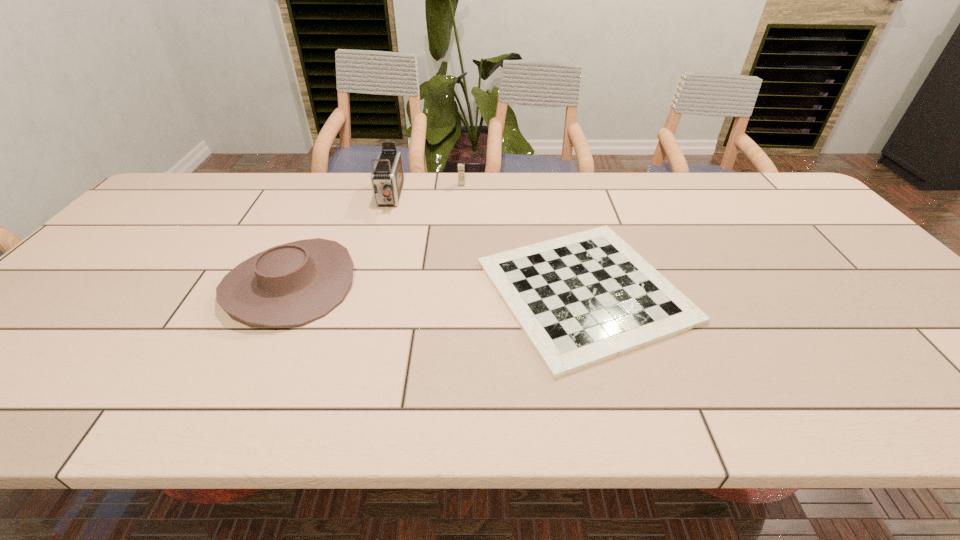
Locate an element on the screen. The image size is (960, 540). the tallest object is located at coordinates (x=387, y=177).

Where is `the second tallest object`? This screenshot has height=540, width=960. the second tallest object is located at coordinates (461, 172).

Find the location of a particular element. The height and width of the screenshot is (540, 960). the second object from right to left is located at coordinates click(461, 172).

Locate an element on the screen. The height and width of the screenshot is (540, 960). cowboy hat is located at coordinates (293, 284).

The width and height of the screenshot is (960, 540). What are the coordinates of `the shortest object` in the screenshot? It's located at (580, 299).

You are a GUI agent. You are given a task and a screenshot of the screen. Output one action in this format:
    pyautogui.click(x=<x>, y=<y>)
    Task: Click on the rightmost object
    The image size is (960, 540).
    Given the screenshot: What is the action you would take?
    pyautogui.click(x=580, y=299)

Image resolution: width=960 pixels, height=540 pixels. Identify the location of free spot located at the lens of the camcorder. pyautogui.click(x=382, y=223).

This screenshot has height=540, width=960. Identify the location of vacant region located 0.300m on the front of the cellular telephone, where the keypad is located. (458, 239).

Image resolution: width=960 pixels, height=540 pixels. I want to click on vacant space situated on the left of the third tallest object, so click(199, 285).

The image size is (960, 540). I want to click on free space located on the right of the checkerboard, so click(772, 291).